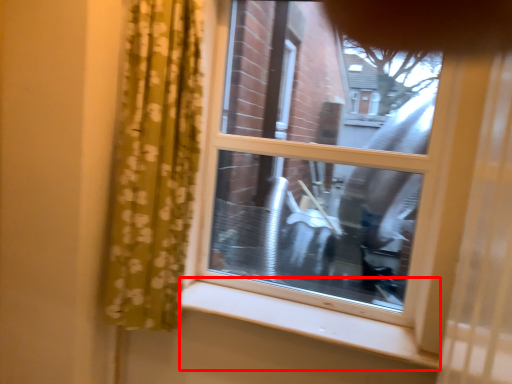
Question: From the image's perspective, what is the correct spatial relationship of window sill (annotated by the red box) in relation to window?

Choices:
 (A) below
 (B) above

Answer: (A)